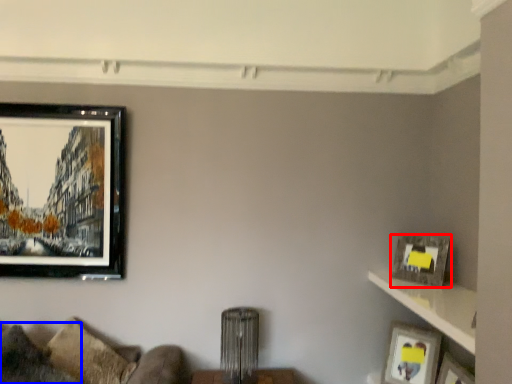
Question: Which of the following is the closest to the observer, picture frame (highlighted by a red box) or pillow (highlighted by a blue box)?

Choices:
 (A) picture frame
 (B) pillow

Answer: (B)